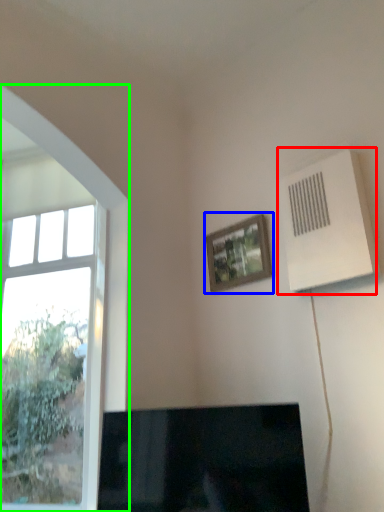
Question: Which object is positioned closest to air conditioning (highlighted by a red box)? Select from picture frame (highlighted by a blue box) and window (highlighted by a green box).

Choices:
 (A) picture frame
 (B) window

Answer: (A)